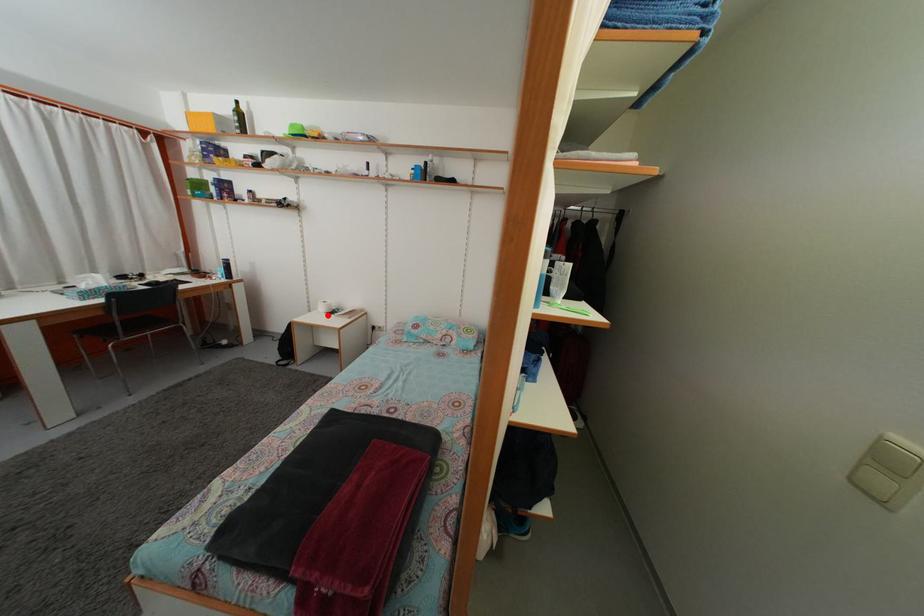
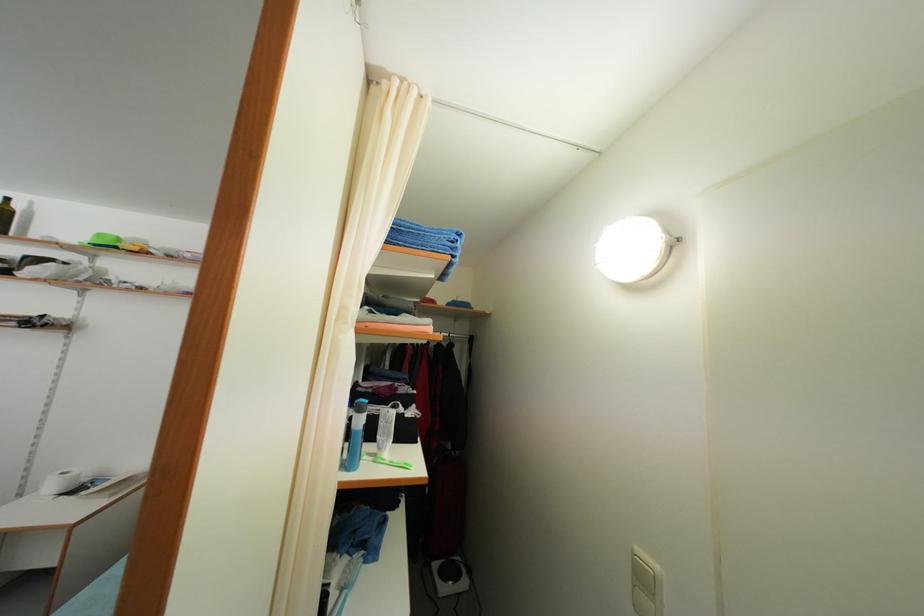
Question: I am providing you with two images of the same scene from different viewpoints. In image1, a red point is highlighted. Considering the same 3D point in image2, which of the following is correct?

Choices:
 (A) It is closer
 (B) It is farther

Answer: (A)